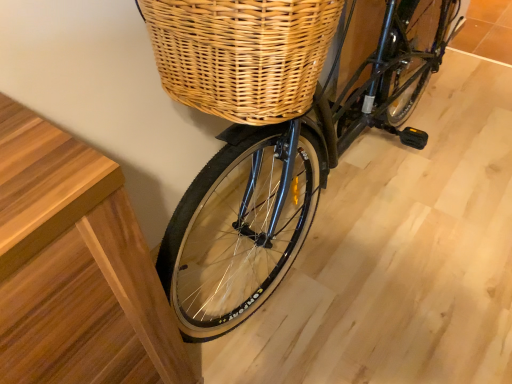
Where is `black matte bicycle at center`? This screenshot has height=384, width=512. black matte bicycle at center is located at coordinates (274, 139).

The height and width of the screenshot is (384, 512). Describe the element at coordinates (274, 139) in the screenshot. I see `black matte bicycle at center` at that location.

Find the location of a particular element. The width and height of the screenshot is (512, 384). black matte bicycle at center is located at coordinates (274, 139).